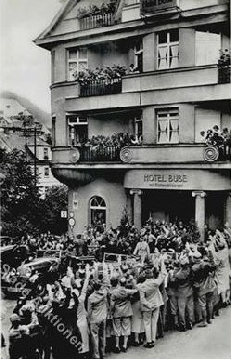
The width and height of the screenshot is (231, 359). I want to click on pillar, so click(201, 209), click(135, 206).